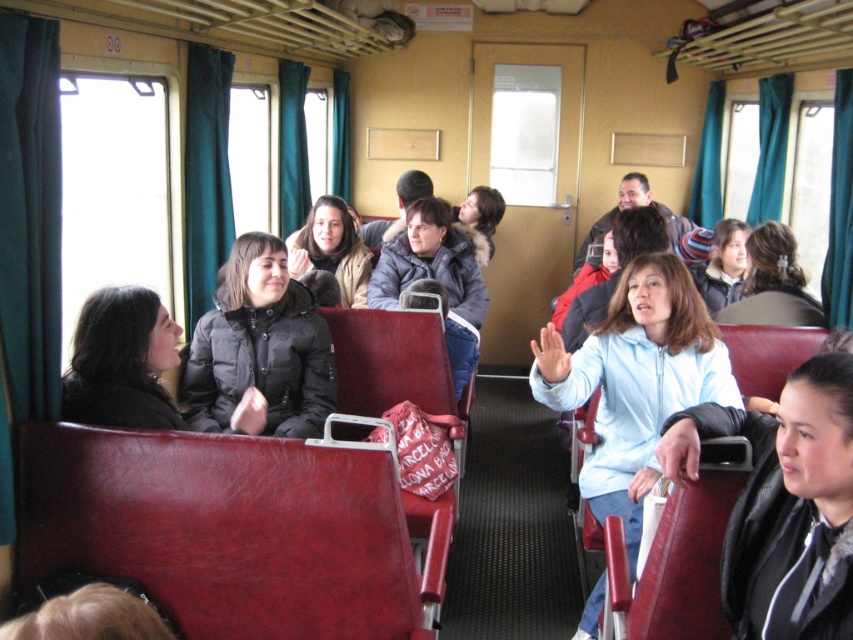
You are a passenger sitting in the train carriage and want to take a photo of both the point at coordinate (751, 499) and the point at coordinate (225, 332). Which point will appear larger in your camera view?

Point at coordinate (751, 499) will appear larger in your camera view because it is closer to the camera than point at coordinate (225, 332).

You are a photographer trying to capture both the black leather jacket at center and the black puffy jacket at center in a single frame. Given that your camera can only focus on objects within a 1.2 meter width, will both jackets fit within the frame?

The black leather jacket at center is smaller than the black puffy jacket at center, but the total width required to include both would depend on their combined size. However, since the camera can focus on objects within a 1.2 meter width and the jackets are both at center, it is likely they can fit within the frame if positioned closely together.

You are a tour guide standing in the train carriage. You need to hand out maps to two tourists wearing the black leather jacket at center and the black puffy jacket at center. The maps are placed on a table 1.5 meters away from you. Can you reach both tourists without moving from your current position?

The black leather jacket at center and black puffy jacket at center are 1.64 meters apart. Since the maps are 1.5 meters away from you, the distance between the two tourists is greater than the distance from you to the table. Therefore, you cannot reach both tourists without moving from your current position.